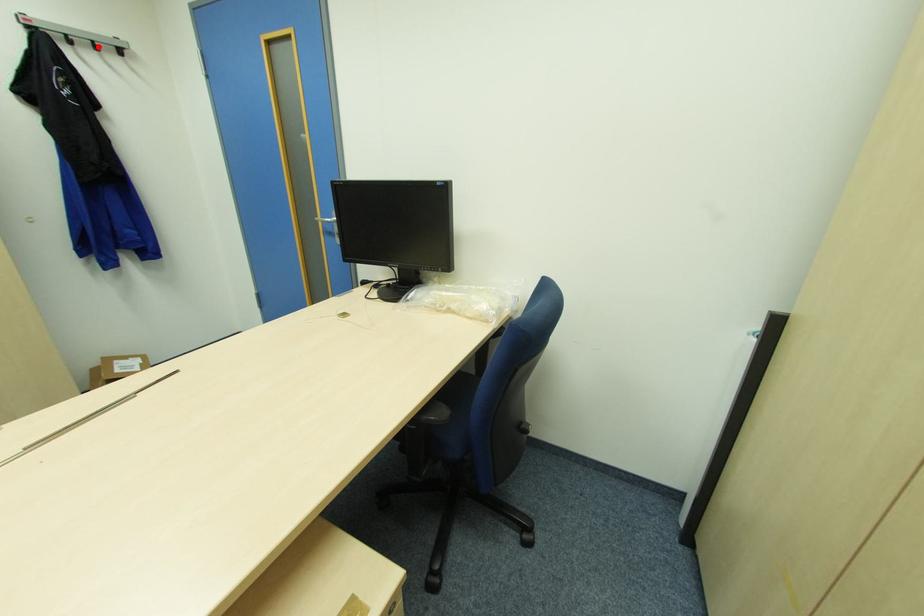
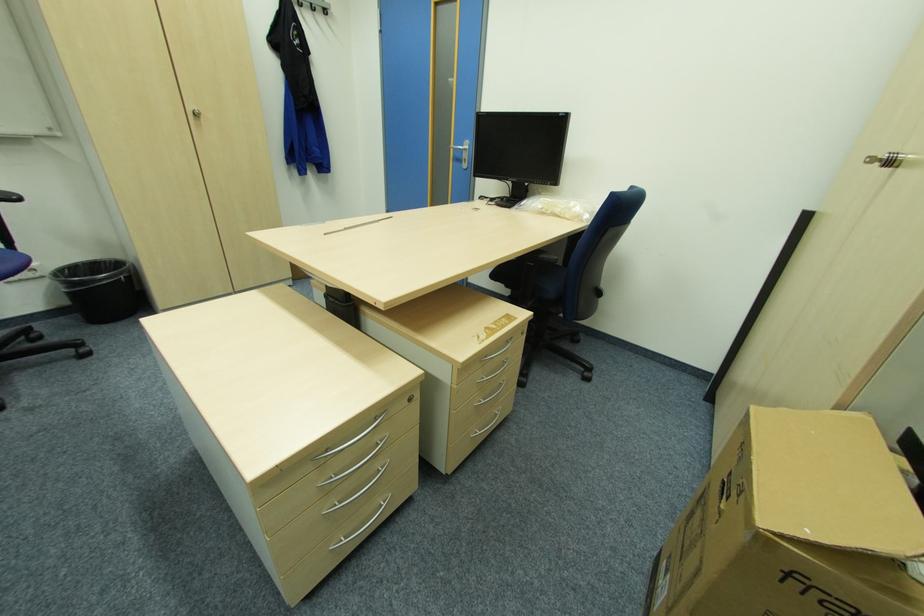
Question: A red point is marked in image1. In image2, is the corresponding 3D point closer to the camera or farther? Reply with the corresponding letter.

Choices:
 (A) The corresponding 3D point is closer.
 (B) The corresponding 3D point is farther.

Answer: (A)